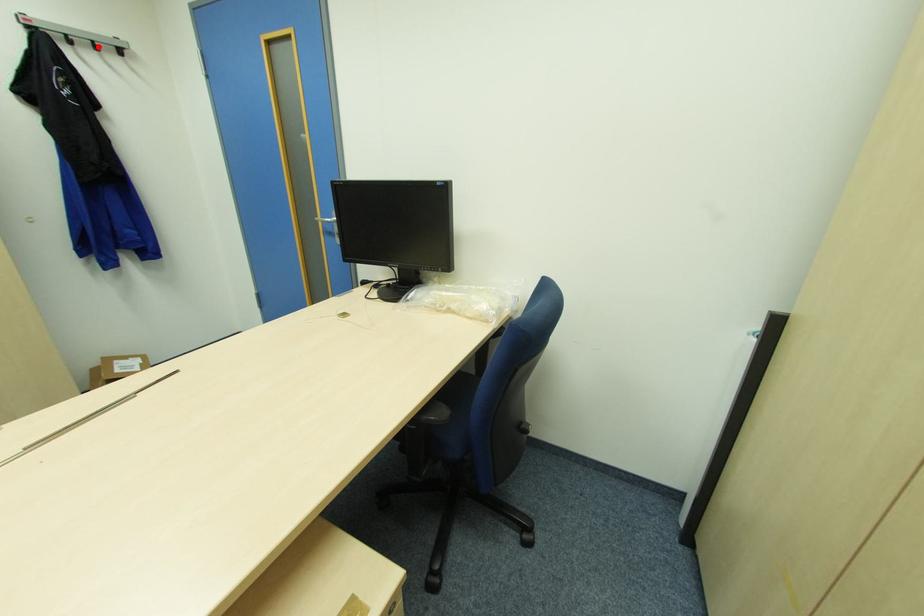
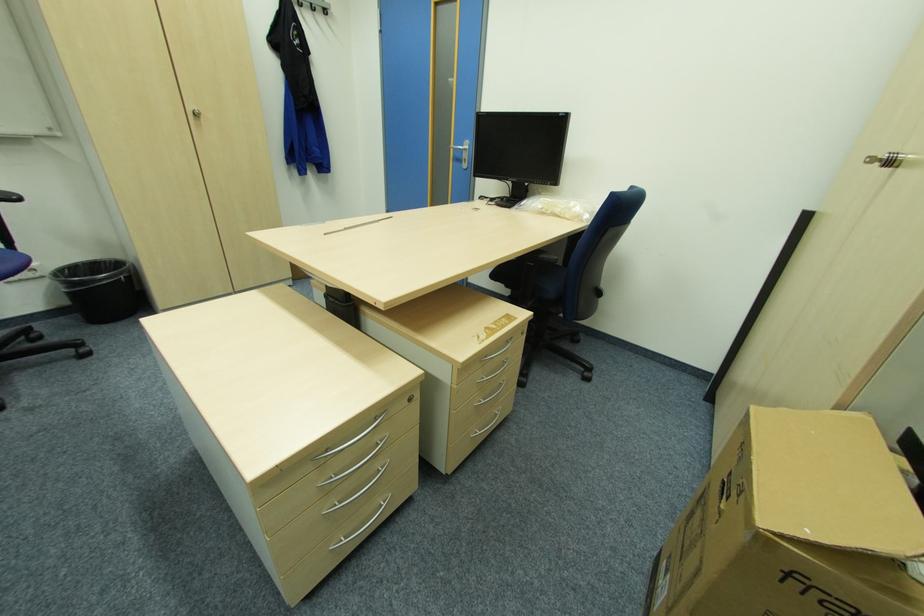
Question: A red point is marked in image1. In image2, is the corresponding 3D point closer to the camera or farther? Reply with the corresponding letter.

Choices:
 (A) The corresponding 3D point is closer.
 (B) The corresponding 3D point is farther.

Answer: (A)